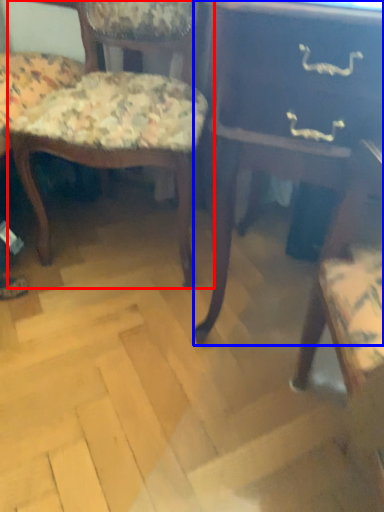
Question: Which object is closer to the camera taking this photo, chair (highlighted by a red box) or table (highlighted by a blue box)?

Choices:
 (A) chair
 (B) table

Answer: (B)